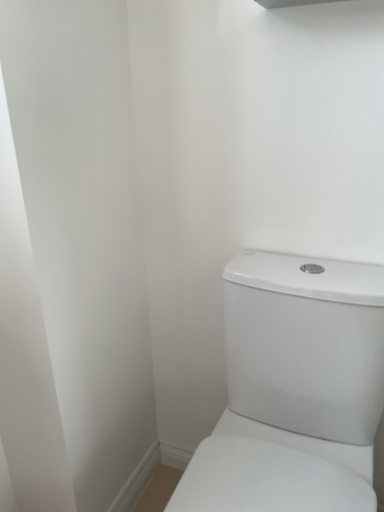
Image resolution: width=384 pixels, height=512 pixels. I want to click on white glossy toilet at lower right, so click(294, 389).

This screenshot has height=512, width=384. What do you see at coordinates (294, 389) in the screenshot? I see `white glossy toilet at lower right` at bounding box center [294, 389].

What is the approximate width of white glossy toilet at lower right?

21.89 inches.

At what (x,y) coordinates should I click in order to perform the action: click on white glossy toilet at lower right. Please return your answer as a coordinate pair (x, y). The image size is (384, 512). Looking at the image, I should click on (294, 389).